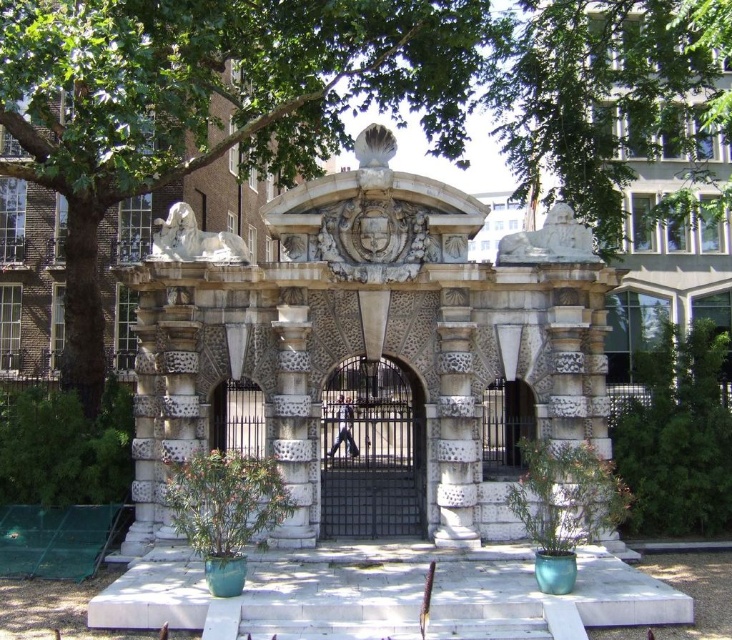
You are standing in front of the grand stone gateway and want to place two decorative lights. The first light is at point (419,237) and the second at point (225,428). Which light will be closer to the viewer?

Point (419,237) is in front of point (225,428), so the first light at point (419,237) will be closer to the viewer.

You are standing in front of the grand stone gateway in the park. You see a point marked at coordinates (212, 100). Based on the scene description, can you identify what object this point is located on?

The point at coordinates (212, 100) is located on the green leafy tree at center.